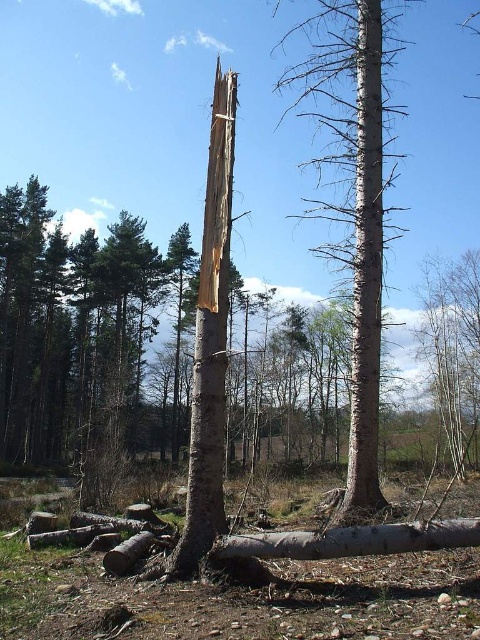
Is bark at center taller than smooth white tree trunk at center?

Correct, bark at center is much taller as smooth white tree trunk at center.

Can you confirm if bark at center is smaller than smooth white tree trunk at center?

No.

The width and height of the screenshot is (480, 640). Identify the location of bark at center. click(x=210, y=340).

Locate an element on the screen. This screenshot has width=480, height=640. smooth gray bark tree at center is located at coordinates (354, 202).

Between point (346, 515) and point (362, 35), which one is positioned behind?

The point (362, 35) is behind.

Where is `smooth gray bark tree at center`? smooth gray bark tree at center is located at coordinates (354, 202).

Can you confirm if smooth gray bark tree at center is positioned to the left of bark at center?

No, smooth gray bark tree at center is not to the left of bark at center.

In the scene shown: How much distance is there between smooth gray bark tree at center and bark at center?

smooth gray bark tree at center is 18.49 meters from bark at center.

Which is behind, point (369, 234) or point (168, 566)?

Point (369, 234)

What are the coordinates of `smooth gray bark tree at center` in the screenshot? It's located at (354, 202).